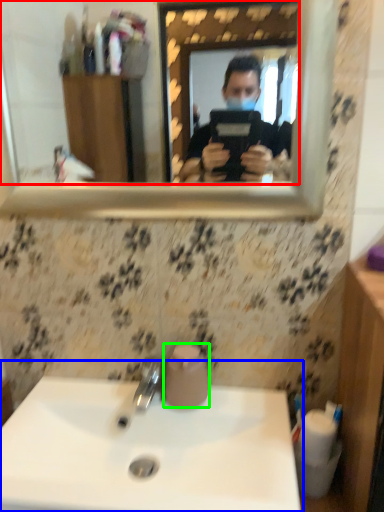
Question: Which object is positioned farthest from mirror (highlighted by a red box)? Select from sink (highlighted by a blue box) and toilet paper (highlighted by a green box).

Choices:
 (A) sink
 (B) toilet paper

Answer: (B)